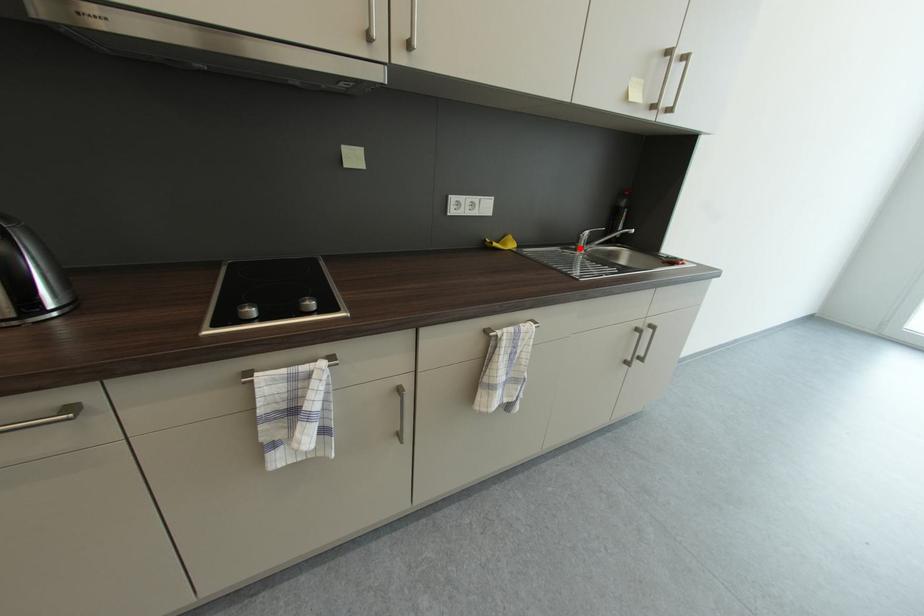
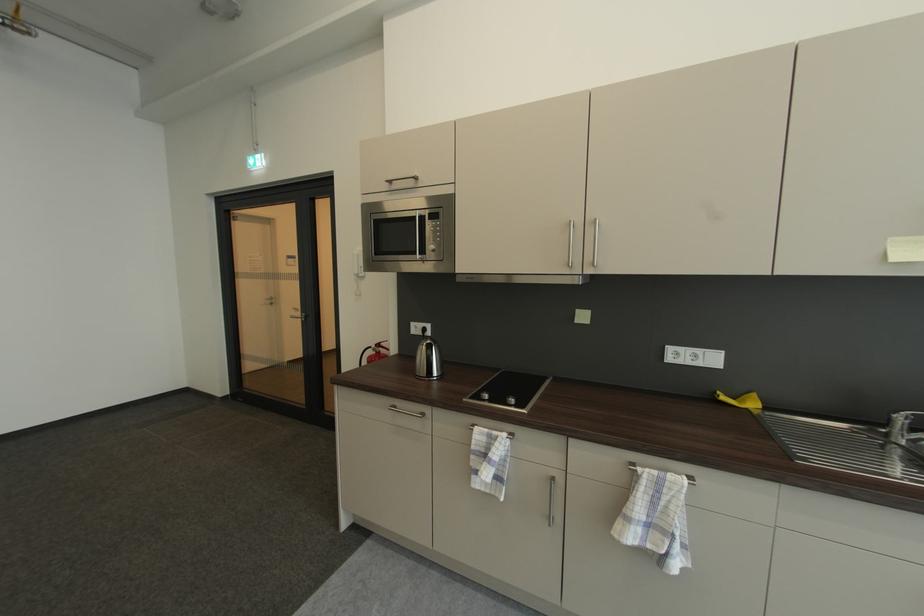
In the second image, find the point that corresponds to the highlighted location in the first image.

(892, 432)